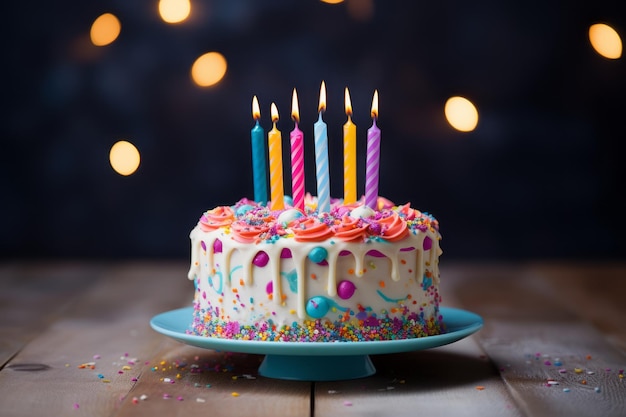
The height and width of the screenshot is (417, 626). Find the location of `candles`. candles is located at coordinates (254, 166), (278, 166), (298, 166), (321, 162), (351, 155), (374, 155).